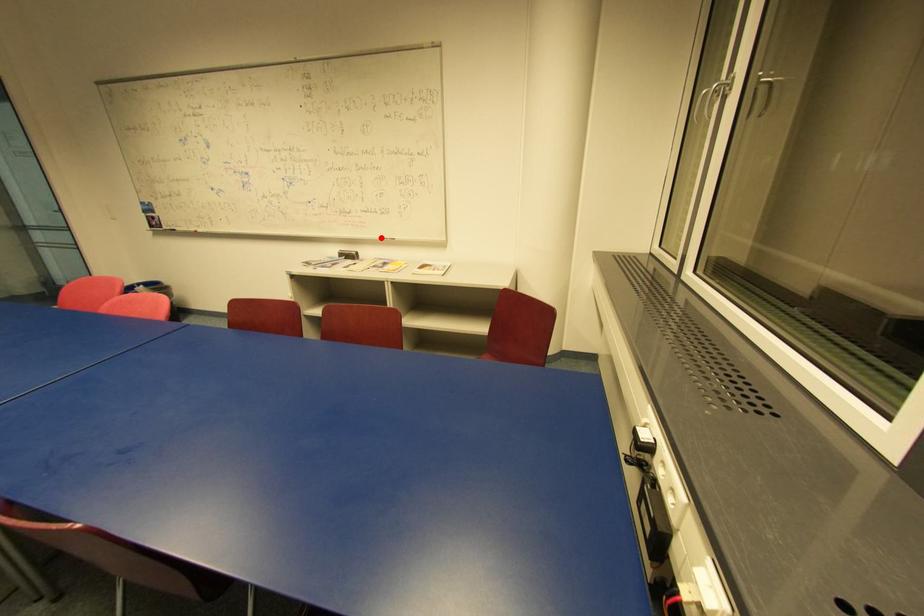
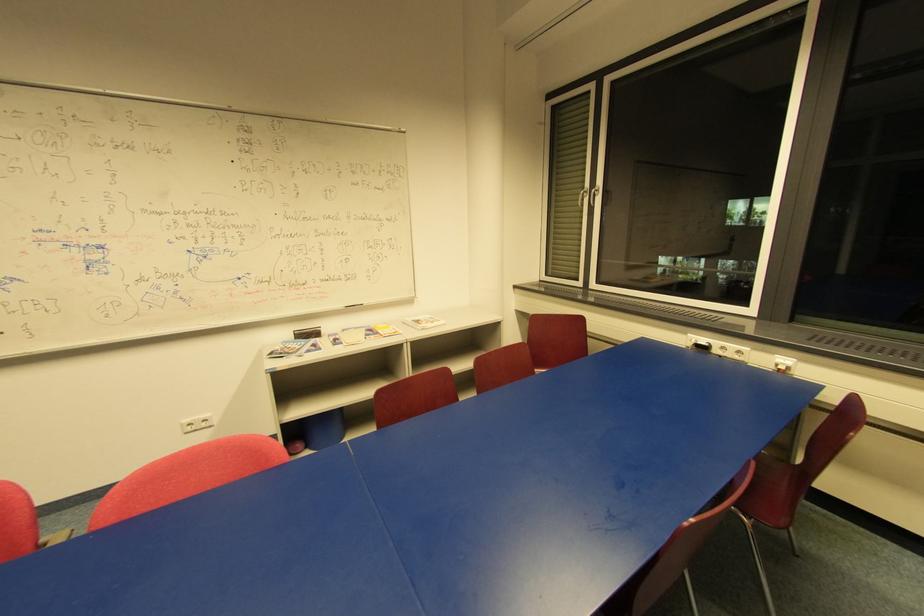
In the second image, find the point that corresponds to the highlighted location in the first image.

(344, 307)